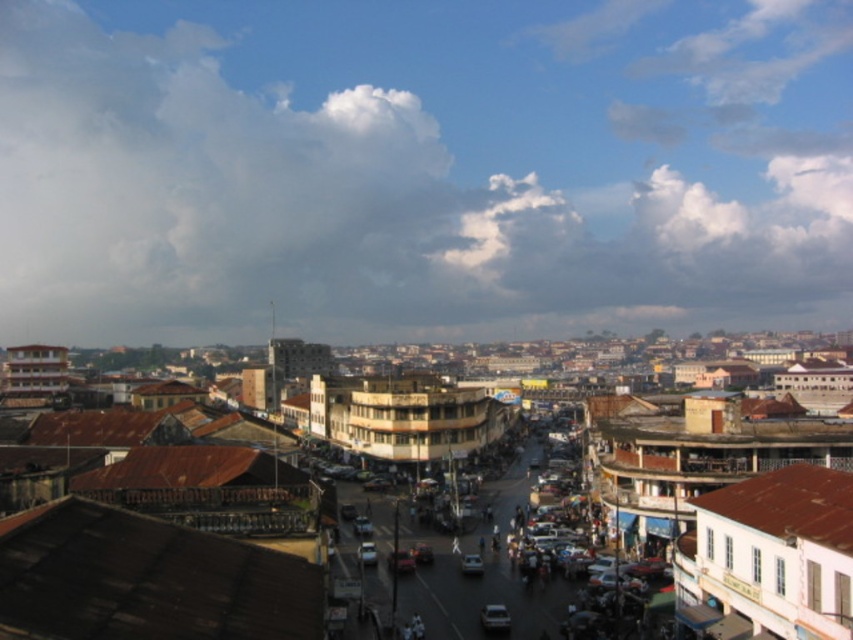
Question: Which point appears farthest from the camera in this image?

Choices:
 (A) (68, 564)
 (B) (171, 211)

Answer: (B)

Question: Which point is farther from the camera taking this photo?

Choices:
 (A) (61, 164)
 (B) (461, 561)
 (C) (425, 394)

Answer: (A)

Question: Observing the image, what is the correct spatial positioning of brown corrugated metal roofs at center in reference to metallic silver car at center?

Choices:
 (A) above
 (B) below

Answer: (A)

Question: Which object is farther from the camera taking this photo?

Choices:
 (A) metallic silver car at center
 (B) brown corrugated metal roofs at center

Answer: (A)

Question: Can you confirm if white fluffy cloud at upper center is wider than brown corrugated metal roofs at center?

Choices:
 (A) no
 (B) yes

Answer: (B)

Question: Where is brown corrugated metal roofs at center located in relation to metallic silver car at center in the image?

Choices:
 (A) above
 (B) below

Answer: (A)